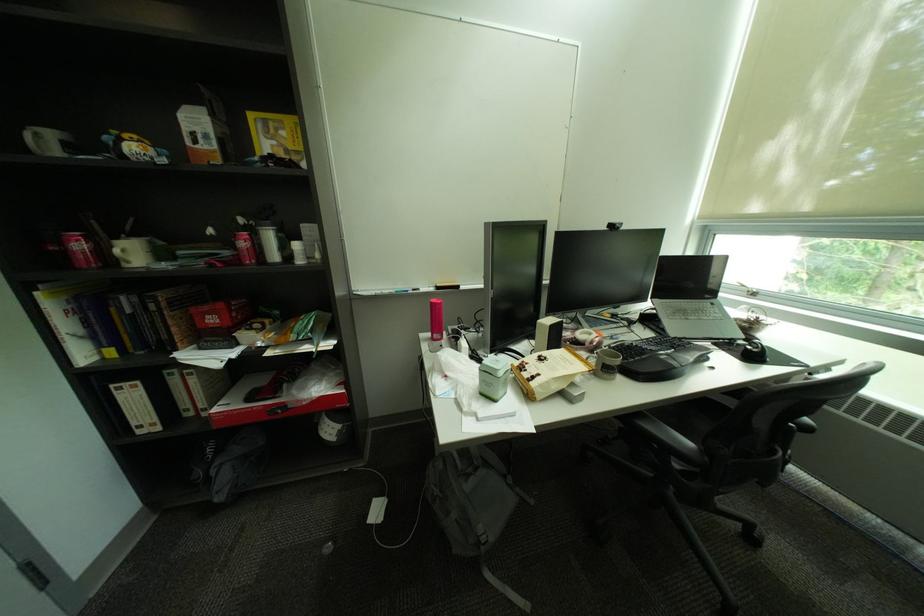
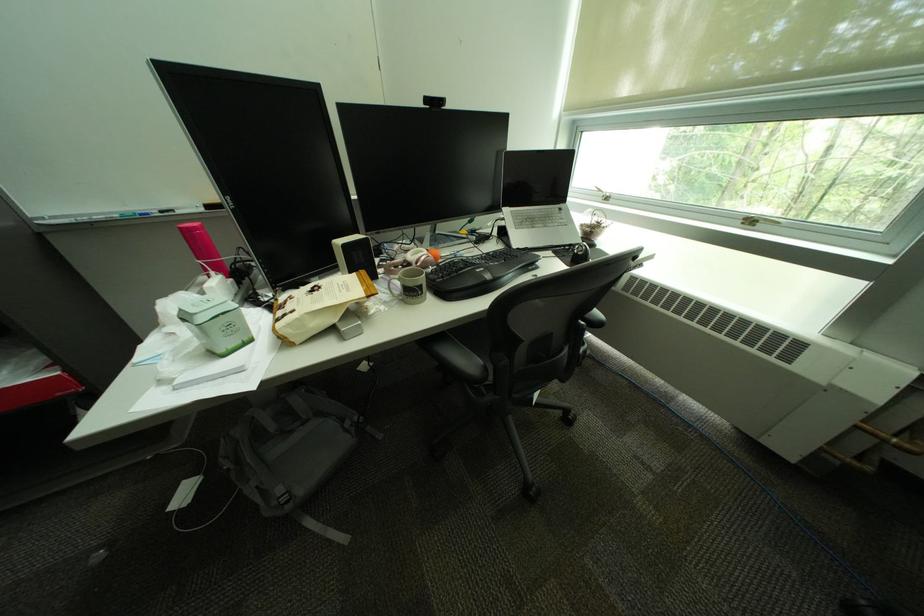
Locate, in the second image, the point that corresponds to the point at 494,549 in the first image.

(299, 508)